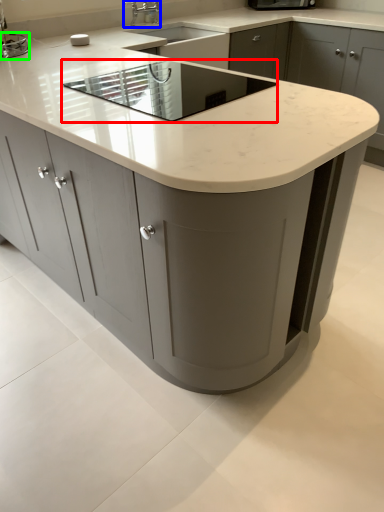
Question: Estimate the real-world distances between objects in this image. Which object is closer to appliance (highlighted by a red box), tap (highlighted by a blue box) or appliance (highlighted by a green box)?

Choices:
 (A) tap
 (B) appliance

Answer: (B)